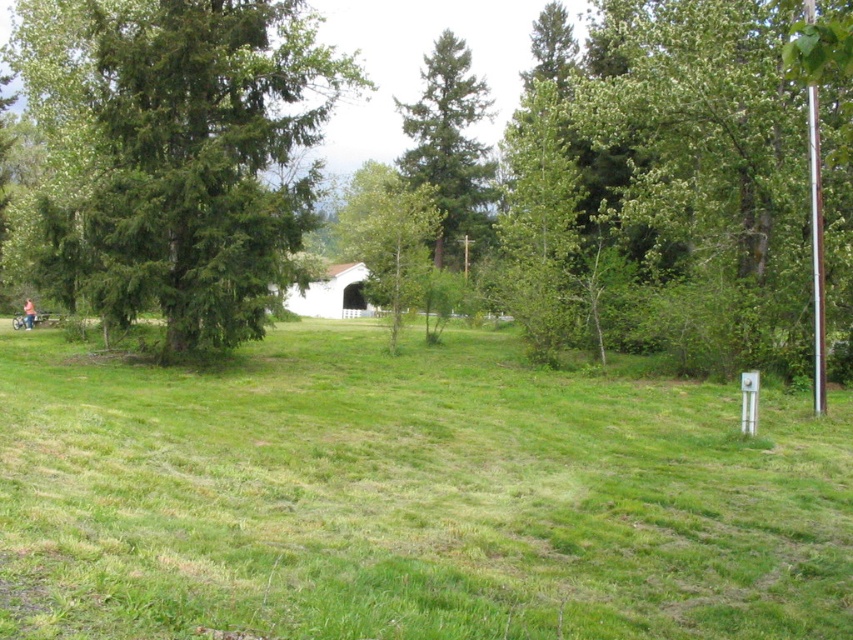
You are planning to set up a picnic blanket in the green grassy field at center. Considering the space, will the light brown wooden bench at lower left be in the way if you spread the blanket to its full size of 2 meters wide?

The green grassy field at center might be wider than the light brown wooden bench at lower left, so there is a possibility that the bench may not obstruct the blanket if the field is sufficiently wide. However, without exact measurements, it is uncertain.

You are standing at the origin point in the image. Where is the green grassy field at center located in terms of coordinates?

The green grassy field at center is located at coordinates point (x=409, y=497).

You are planning to set up a picnic blanket in the green grassy field at center. Considering the space available, will the white painted wood hut at center interfere with the setup? Please explain.

The green grassy field at center is wider than the white painted wood hut at center, so there is sufficient space to set up the picnic blanket without interference from the hut.